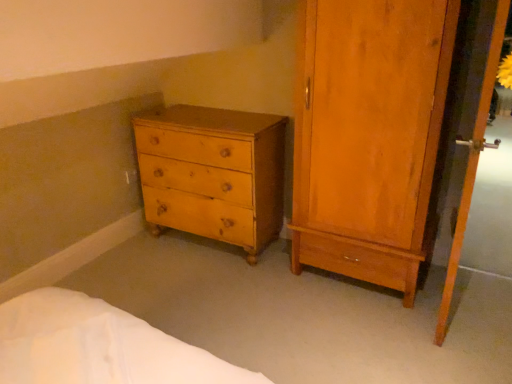
Locate an element on the screen. The width and height of the screenshot is (512, 384). vacant space to the left of matte wood wardrobe at right is located at coordinates (262, 296).